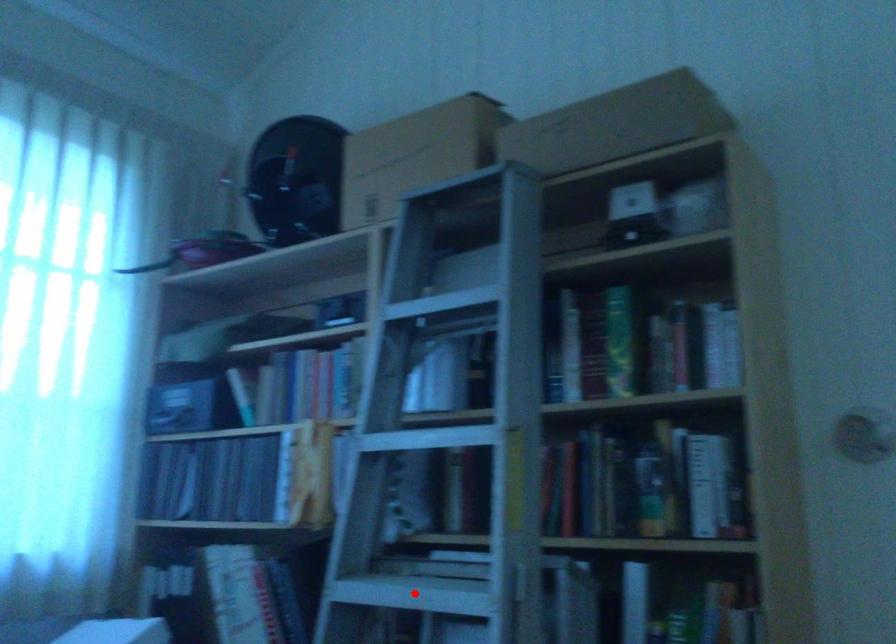
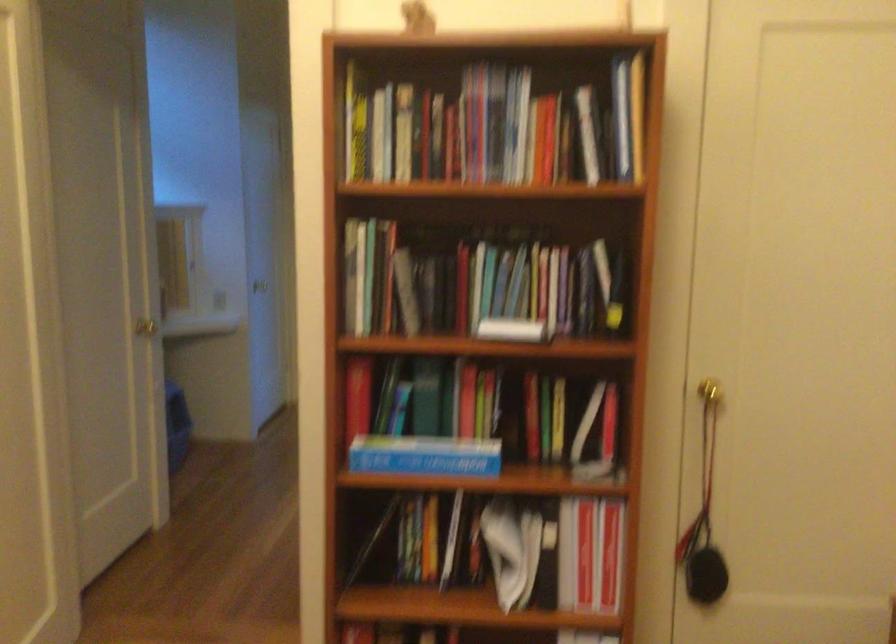
Question: I am providing you with two images of the same scene from different viewpoints. A red point is marked on the first image. At the location where the point appears in image 1, is it still visible in image 2?

Choices:
 (A) Yes
 (B) No

Answer: (B)